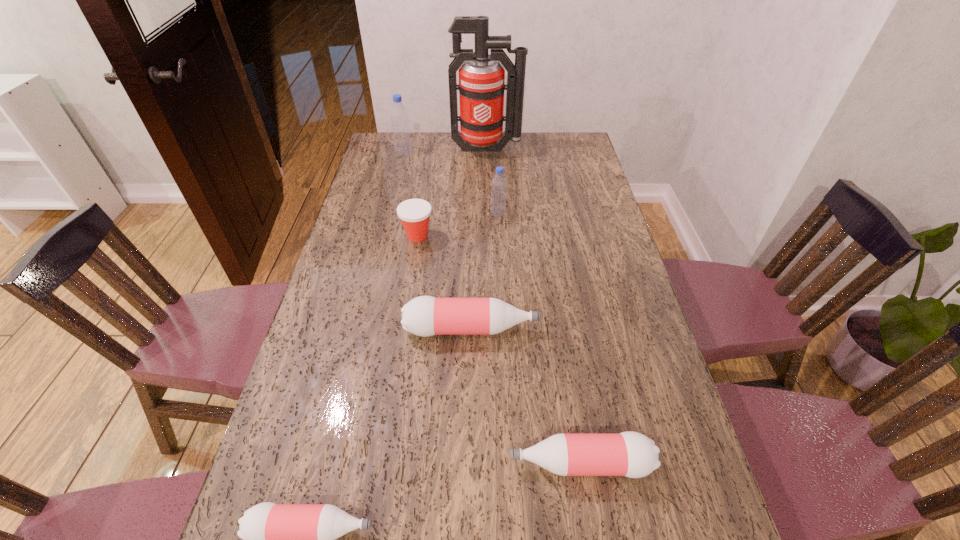
In order to click on free space between the fourth nearest object and the second nearest object in this screenshot , I will do `click(498, 349)`.

Locate an element on the screen. This screenshot has width=960, height=540. free spot between the red-orange Dixie cup and the bigger blue bottle is located at coordinates (411, 194).

Find the location of a particular element. vacant space in between the farthest pink bottle and the fourth nearest object is located at coordinates (444, 282).

Locate an element on the screen. This screenshot has width=960, height=540. vacant point located between the biggest pink bottle and the red-orange Dixie cup is located at coordinates (444, 282).

What are the coordinates of `vacant space that's between the fifth shortest object and the farthest pink bottle` in the screenshot? It's located at (485, 271).

Identify which object is located as the fourth nearest to the fire extinguisher. Please provide its 2D coordinates. Your answer should be formatted as a tuple, i.e. [(x, y)], where the tuple contains the x and y coordinates of a point satisfying the conditions above.

[(424, 316)]

This screenshot has height=540, width=960. Identify the location of object that is the fifth closest one to the third shortest bottle. (481, 87).

Identify the location of bottle that can be found as the third closest to the third farthest bottle. The height and width of the screenshot is (540, 960). (499, 183).

Choose which bottle is the third nearest neighbor to the red-orange Dixie cup. Please provide its 2D coordinates. Your answer should be formatted as a tuple, i.e. [(x, y)], where the tuple contains the x and y coordinates of a point satisfying the conditions above.

[(399, 116)]

Find the location of a particular element. This screenshot has height=540, width=960. pink bottle that is the closest to the bigger blue bottle is located at coordinates (424, 316).